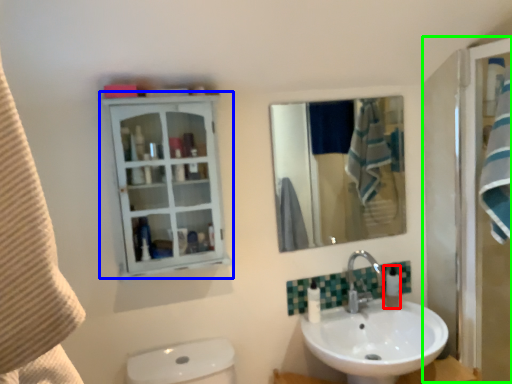
Question: Considering the real-world distances, which object is closest to soap dispenser (highlighted by a red box)? bathroom cabinet (highlighted by a blue box) or screen door (highlighted by a green box).

Choices:
 (A) bathroom cabinet
 (B) screen door

Answer: (B)